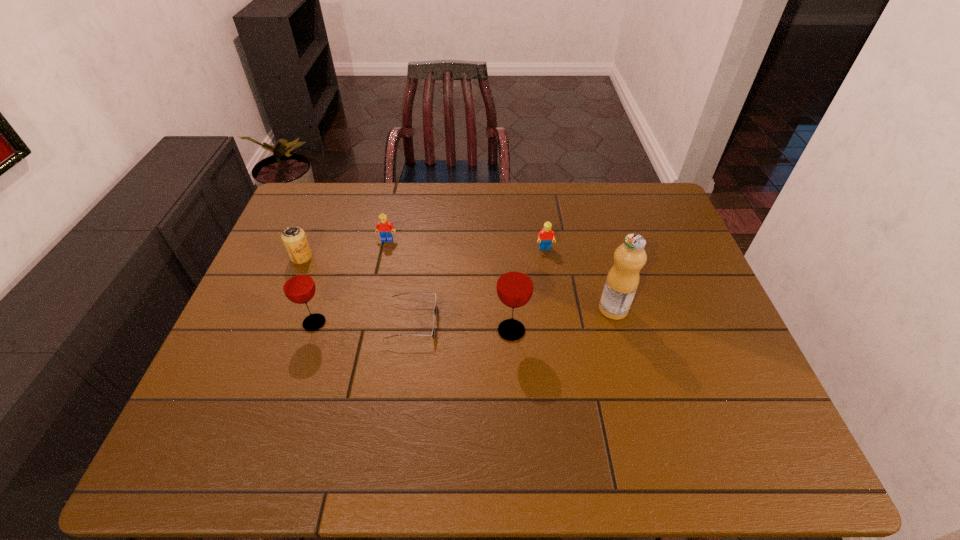
All glasss are currently evenly spaced. To continue this pattern, where would you add another glass on the right? Please point out a vacant spot. Please provide its 2D coordinates. Your answer should be formatted as a tuple, i.e. [(x, y)], where the tuple contains the x and y coordinates of a point satisfying the conditions above.

[(714, 339)]